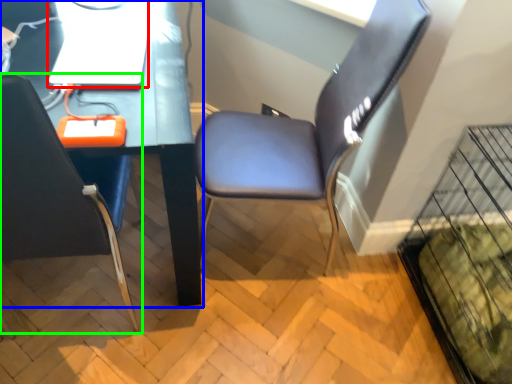
Question: Which object is positioned closest to computer (highlighted by a red box)? Select from computer desk (highlighted by a blue box) and chair (highlighted by a green box).

Choices:
 (A) computer desk
 (B) chair

Answer: (A)